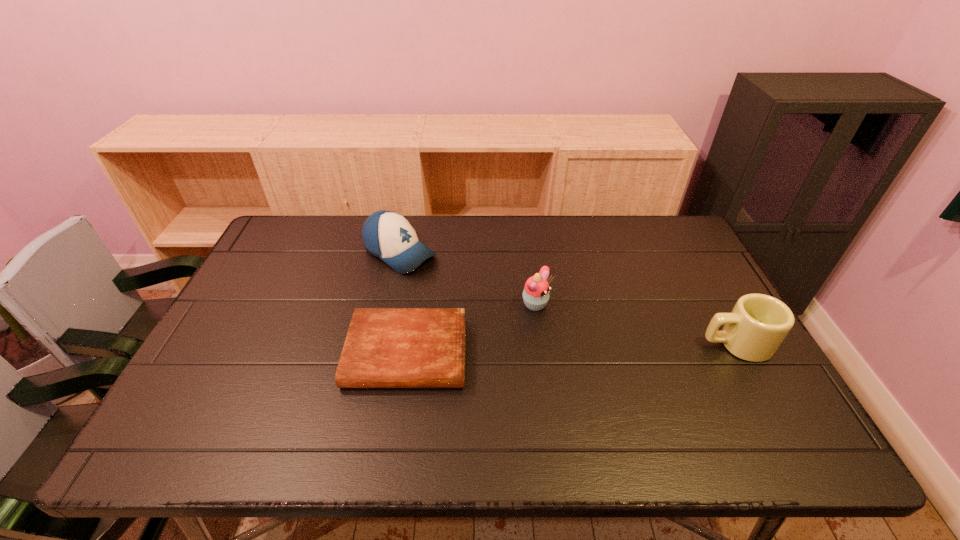
Where is `free space between the rightmost object and the farthest object`? The image size is (960, 540). free space between the rightmost object and the farthest object is located at coordinates (568, 299).

Image resolution: width=960 pixels, height=540 pixels. Find the location of `free point between the shortest object and the farthest object`. free point between the shortest object and the farthest object is located at coordinates (403, 303).

I want to click on free space between the baseball cap and the cupcake, so click(x=468, y=280).

You are a GUI agent. You are given a task and a screenshot of the screen. Output one action in this format:
    pyautogui.click(x=<x>, y=<y>)
    Task: Click on the vacant region between the Bible and the third nearest object
    This screenshot has height=540, width=960.
    Given the screenshot: What is the action you would take?
    pyautogui.click(x=472, y=330)

Locate which object is the third closest to the baseball cap. Please provide its 2D coordinates. Your answer should be formatted as a tuple, i.e. [(x, y)], where the tuple contains the x and y coordinates of a point satisfying the conditions above.

[(758, 324)]

Where is `object that stands as the third closest to the farthest object`? The width and height of the screenshot is (960, 540). object that stands as the third closest to the farthest object is located at coordinates (758, 324).

I want to click on free space that satisfies the following two spatial constraints: 1. on the front side of the rightmost object; 2. with the handle on the side of the third nearest object, so click(x=542, y=344).